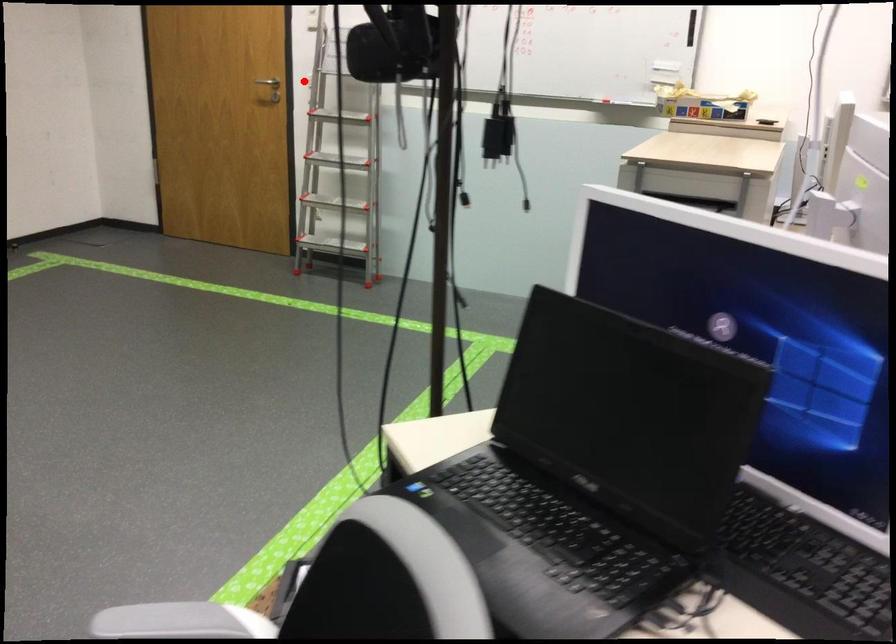
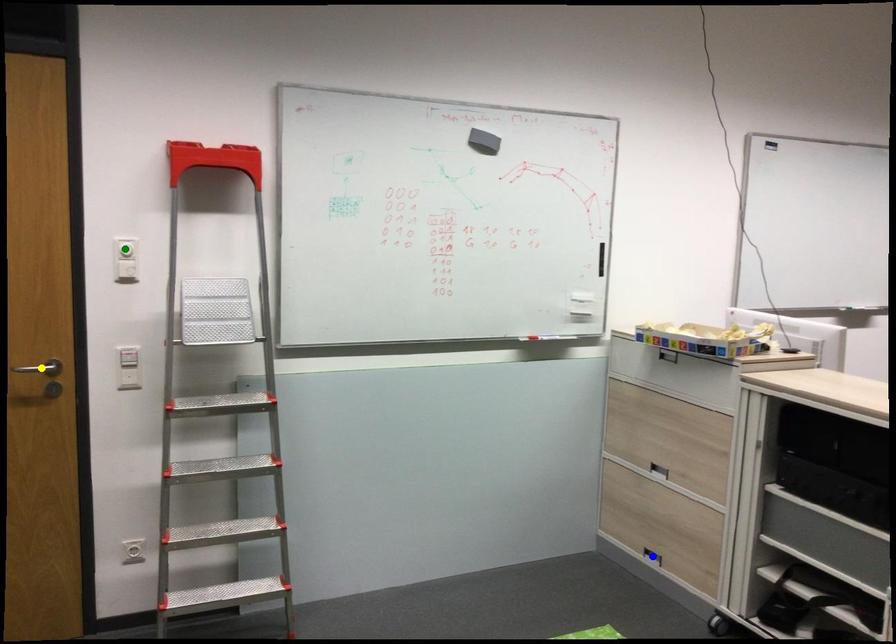
Question: I am providing you with two images of the same scene from different viewpoints. A red point is marked on the first image. You are given multiple points on the second image. Which spot in image 2 lines up with the point in image 1?

Choices:
 (A) green point
 (B) yellow point
 (C) blue point

Answer: (B)